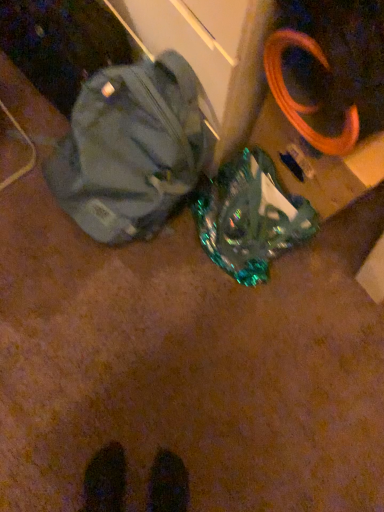
Question: From the image's perspective, relative to matte gray backpack at center, is holographic plastic bag at center above or below?

Choices:
 (A) above
 (B) below

Answer: (B)

Question: From a real-world perspective, is holographic plastic bag at center above or below matte gray backpack at center?

Choices:
 (A) above
 (B) below

Answer: (B)

Question: Is point (249, 236) closer or farther from the camera than point (104, 228)?

Choices:
 (A) closer
 (B) farther

Answer: (A)

Question: Does point (152, 190) appear closer or farther from the camera than point (231, 199)?

Choices:
 (A) closer
 (B) farther

Answer: (A)

Question: Considering the positions of matte gray backpack at center and holographic plastic bag at center in the image, is matte gray backpack at center wider or thinner than holographic plastic bag at center?

Choices:
 (A) thin
 (B) wide

Answer: (B)

Question: Is matte gray backpack at center inside the boundaries of holographic plastic bag at center, or outside?

Choices:
 (A) inside
 (B) outside

Answer: (B)

Question: Based on their sizes in the image, would you say matte gray backpack at center is bigger or smaller than holographic plastic bag at center?

Choices:
 (A) small
 (B) big

Answer: (B)